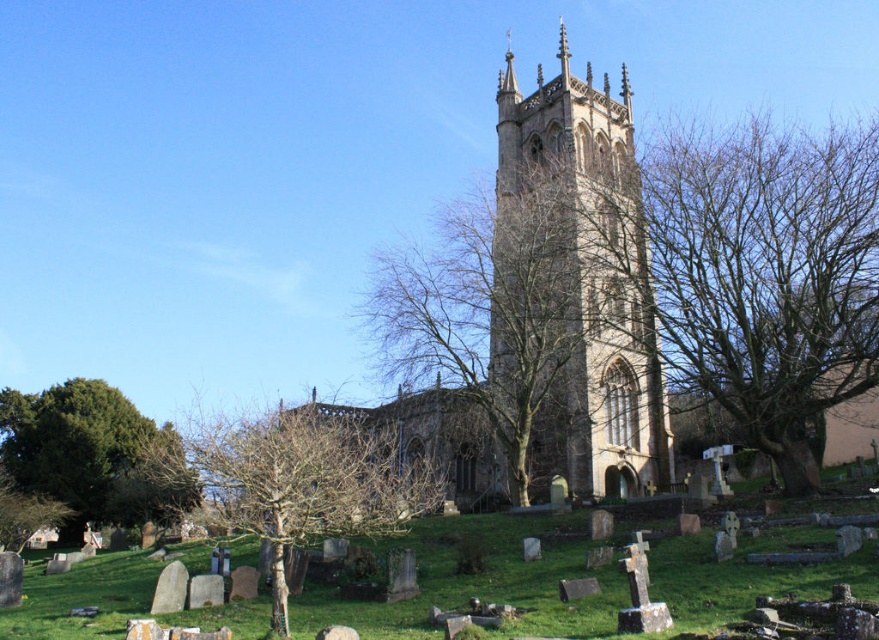
Question: Which of the following is the farthest from the observer?

Choices:
 (A) brown stone tower at center
 (B) green grassy at center

Answer: (A)

Question: Is brown stone church at center positioned before brown stone tower at center?

Choices:
 (A) no
 (B) yes

Answer: (B)

Question: Does green grassy at center have a larger size compared to green leafy tree at lower left?

Choices:
 (A) no
 (B) yes

Answer: (B)

Question: Which of the following is the closest to the observer?

Choices:
 (A) green grassy at center
 (B) green leafy tree at lower left
 (C) bare branches at lower left
 (D) brown stone tower at center

Answer: (A)

Question: Which object is farther from the camera taking this photo?

Choices:
 (A) bare branches at lower left
 (B) brown stone church at center
 (C) green grassy at center
 (D) green leafy tree at lower left

Answer: (D)

Question: Does brown stone church at center appear on the left side of green grassy at center?

Choices:
 (A) no
 (B) yes

Answer: (A)